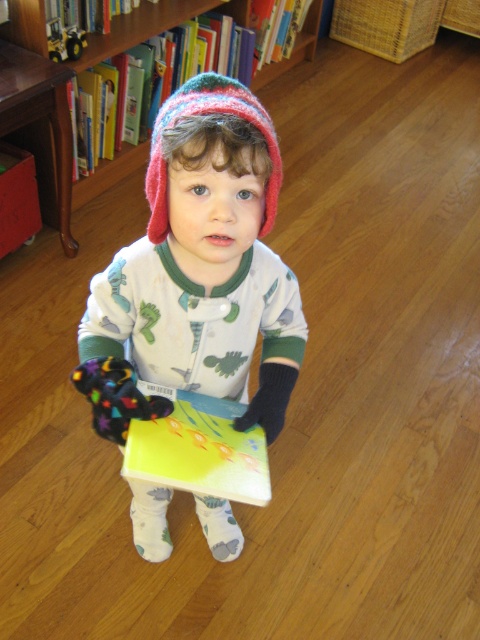
You are a robot navigating the library. You need to move from your current position to the bookshelf. There are two points marked in the scene. Point A is at coordinates point(273, 140) and Point B is at coordinates point(230, 13). Which point should you avoid to ensure you don t collide with any obstacles?

Point B at coordinates point(230, 13) should be avoided because it is behind point(273, 140), which might block the path.

You are a tailor who needs to know if the knitted woolen hat at center can fit into a storage box designed for items smaller than the yellow paper book at upper center. Based on the scene, can the hat fit?

The knitted woolen hat at center has a width less than the yellow paper book at upper center, so it can fit into the storage box designed for items smaller than the yellow paper book at upper center.

From the picture: You are a photographer trying to capture the child in the image. The child is standing at point (197,272). You want to place a small stool at a position that is exactly 0.1 units to the right of the child. What coordinates should the stool be placed at?

The child is at point (197,272). To place the stool 0.1 units to the right, add 0.1 to the x coordinate. The new coordinates would be 0.525, 0.412.